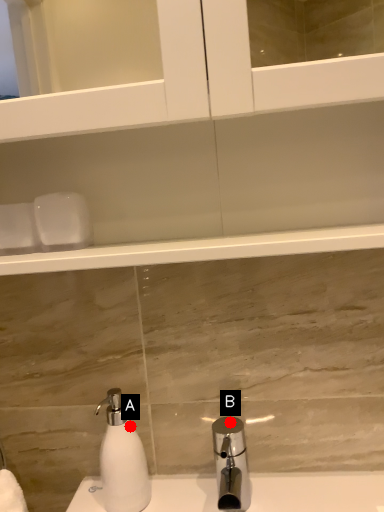
Question: Two points are circled on the image, labeled by A and B beside each circle. Which of the following is the farthest from the observer?

Choices:
 (A) A is further
 (B) B is further

Answer: (A)